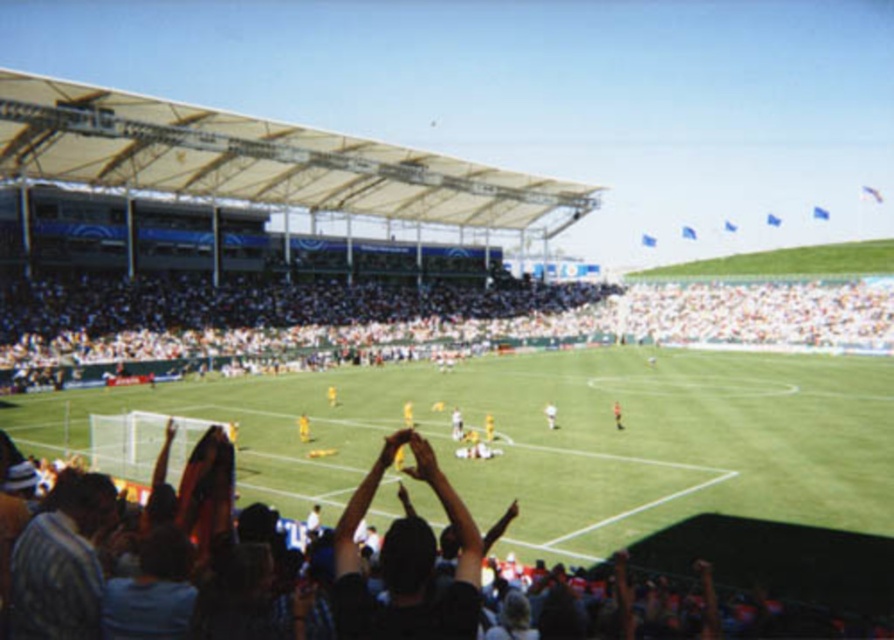
Which of these two, white matte soccer player at center or yellow jersey at center, stands taller?

Standing taller between the two is yellow jersey at center.

Who is positioned more to the left, white matte soccer player at center or yellow jersey at center?

white matte soccer player at center is more to the left.

Measure the distance between point (547,428) and camera.

Point (547,428) is 41.09 meters from camera.

Identify the location of white matte soccer player at center. The height and width of the screenshot is (640, 894). (550, 416).

Find the location of a particular element. This screenshot has height=640, width=894. white fabric crowd at lower left is located at coordinates (508, 330).

Between black fabric crowd at lower center and white matte soccer player at center, which one has more height?

black fabric crowd at lower center is taller.

Does black fabric crowd at lower center appear on the right side of white matte soccer player at center?

In fact, black fabric crowd at lower center is to the left of white matte soccer player at center.

Locate an element on the screen. Image resolution: width=894 pixels, height=640 pixels. black fabric crowd at lower center is located at coordinates (783, 570).